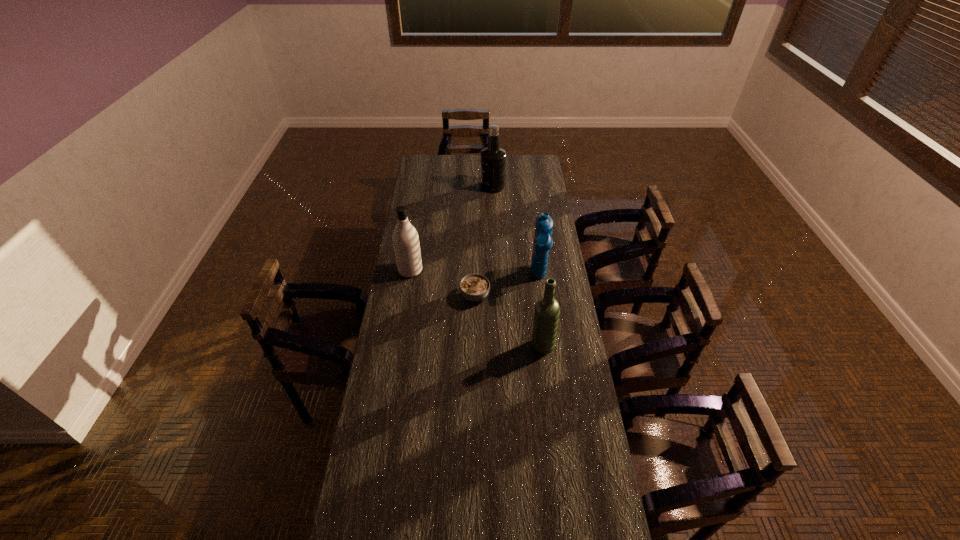
The width and height of the screenshot is (960, 540). I want to click on vacant space that satisfies the following two spatial constraints: 1. on the front label of the wine bottle; 2. on the left side of the farthest object, so click(498, 346).